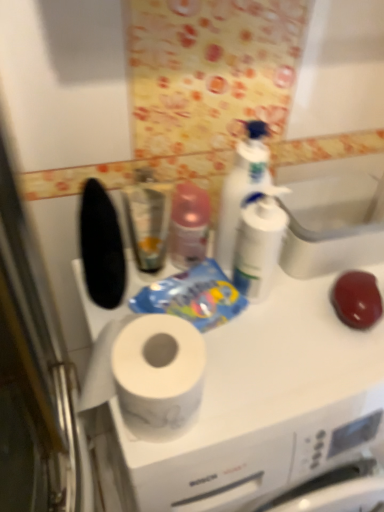
Identify the location of free spot in front of white glossy bottle at upper center. The height and width of the screenshot is (512, 384). (282, 353).